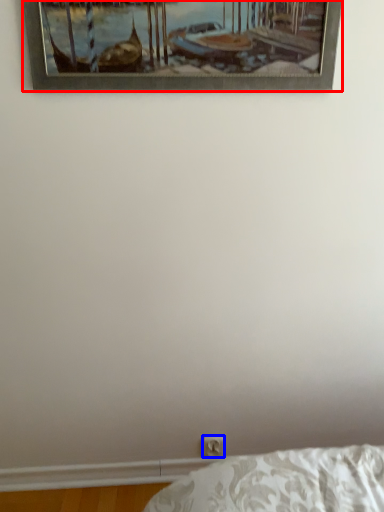
Question: Which object appears farthest to the camera in this image, picture frame (highlighted by a red box) or electric outlet (highlighted by a blue box)?

Choices:
 (A) picture frame
 (B) electric outlet

Answer: (B)